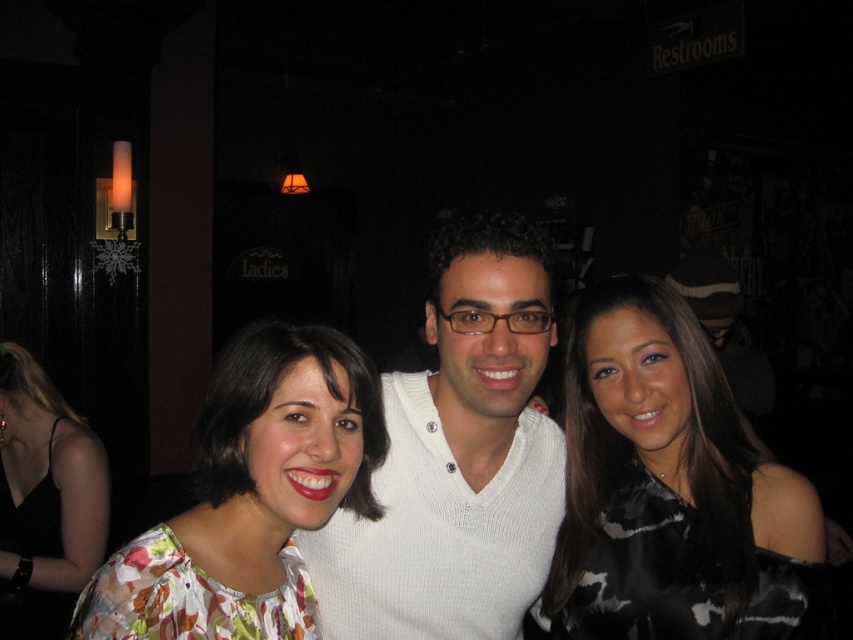
Question: Does white knitted sweater at center have a lesser width compared to floral fabric dress at center?

Choices:
 (A) no
 (B) yes

Answer: (B)

Question: Which object is farther from the camera taking this photo?

Choices:
 (A) black satin dress at center
 (B) white knitted sweater at center
 (C) floral fabric dress at center

Answer: (C)

Question: Is floral fabric blouse at center thinner than floral fabric dress at center?

Choices:
 (A) no
 (B) yes

Answer: (B)

Question: Which of the following is the closest to the observer?

Choices:
 (A) (491, 547)
 (B) (556, 627)
 (C) (18, 442)

Answer: (A)

Question: Does white knitted sweater at center have a smaller size compared to floral fabric dress at center?

Choices:
 (A) yes
 (B) no

Answer: (A)

Question: Among these objects, which one is farthest from the camera?

Choices:
 (A) white knitted sweater at center
 (B) black satin dress at center

Answer: (B)